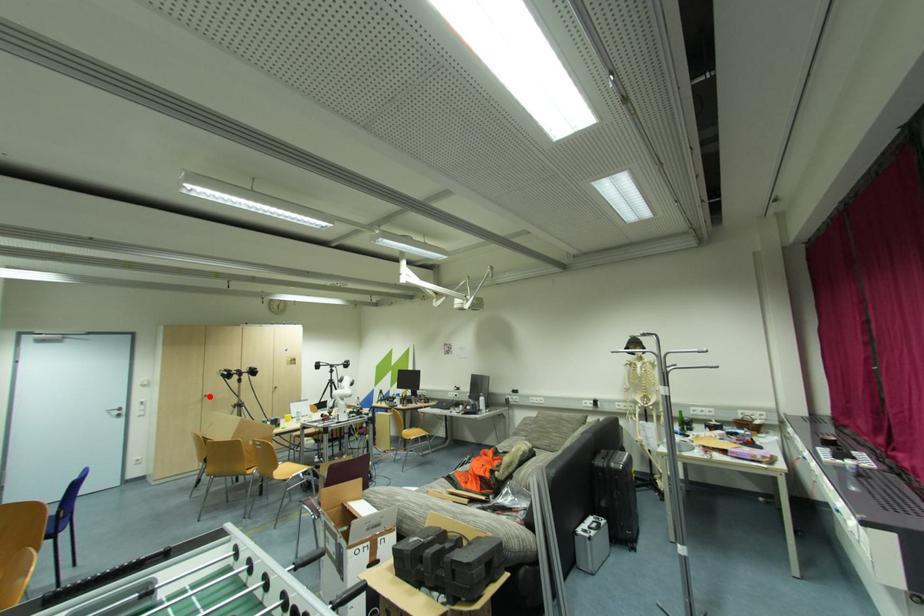
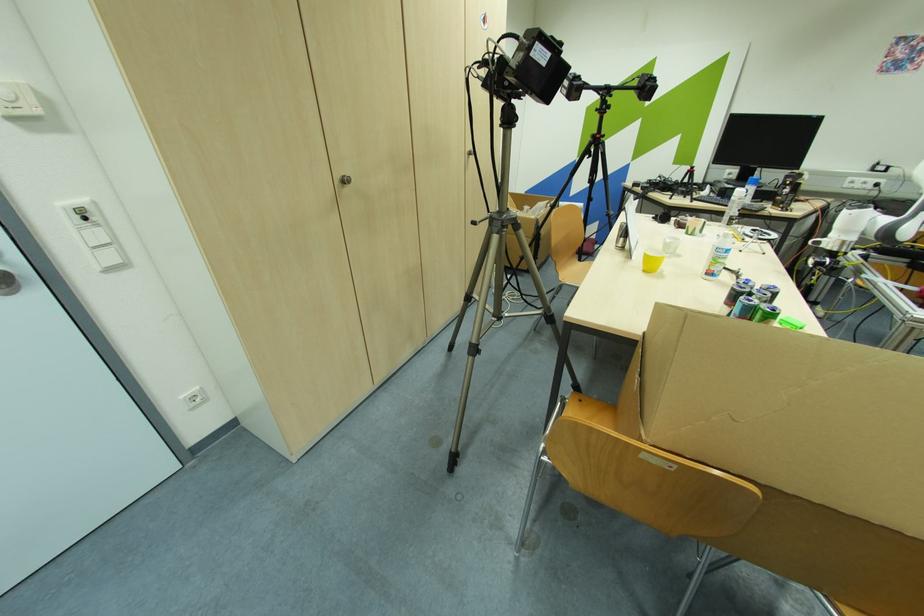
Find the pixel in the second image that matches the highlighted location in the first image.

(348, 182)